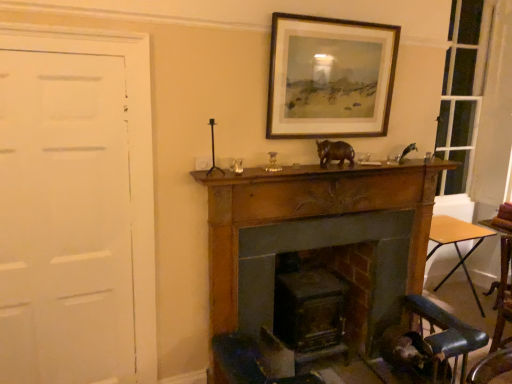
Find the location of `blank space situated above wooden framed painting at upper center (from a real-world perspective)`. blank space situated above wooden framed painting at upper center (from a real-world perspective) is located at coordinates tap(337, 22).